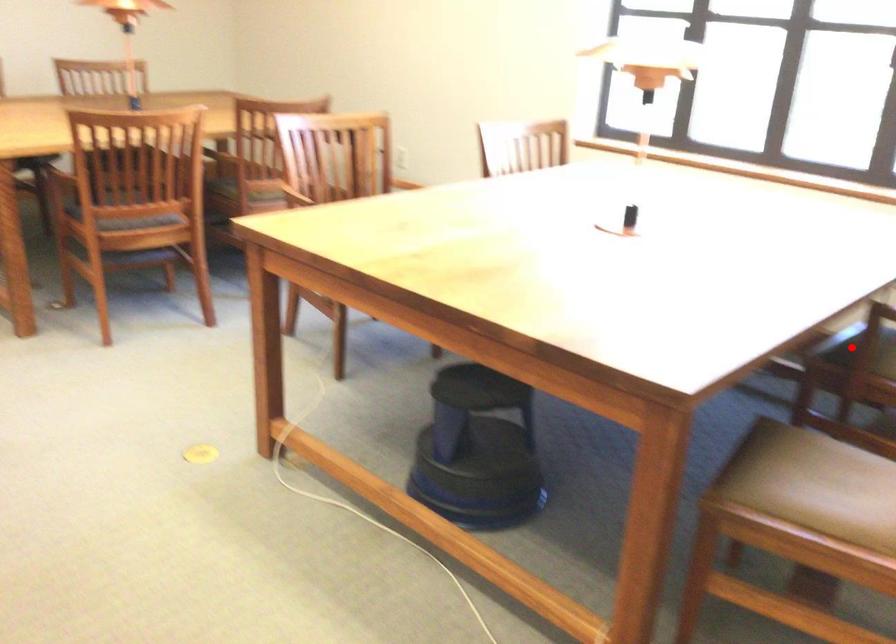
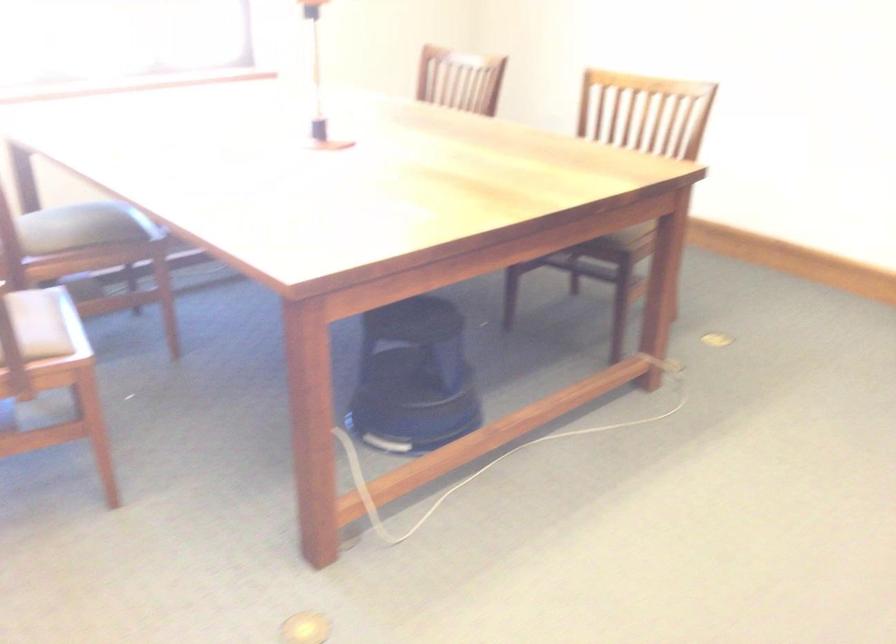
Question: I am providing you with two images of the same scene from different viewpoints. A red point is marked on the first image. Is the red point's position out of view in image 2?

Choices:
 (A) Yes
 (B) No

Answer: (A)